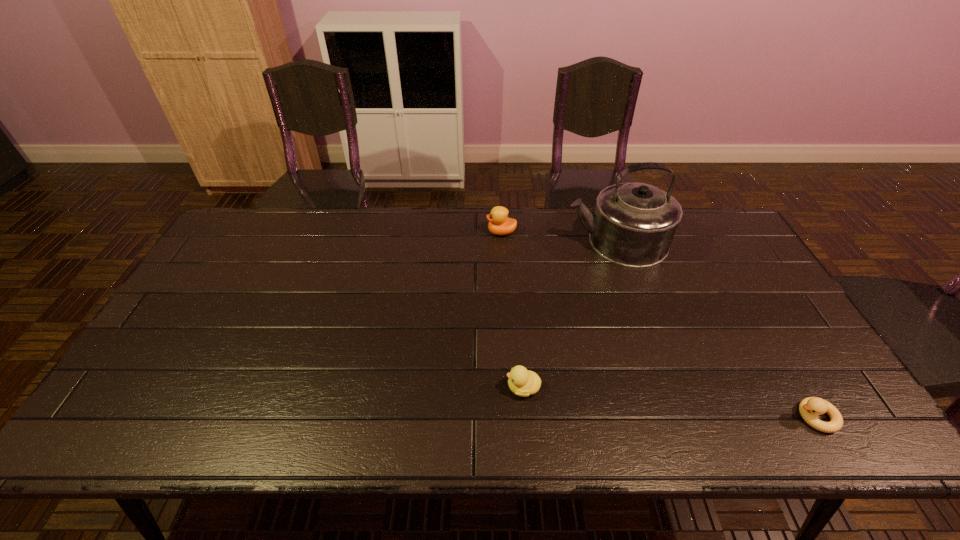
In the image, there is a desktop. At what (x,y) coordinates should I click in order to perform the action: click on vacant space at the near edge. Please return your answer as a coordinate pair (x, y). Looking at the image, I should click on (515, 438).

Find the location of a particular element. vacant area at the left edge of the desktop is located at coordinates (211, 345).

Find the location of `vacant region at the right edge of the desktop`. vacant region at the right edge of the desktop is located at coordinates (783, 376).

Where is `free region at the far left corner of the desktop`? The height and width of the screenshot is (540, 960). free region at the far left corner of the desktop is located at coordinates (252, 244).

What are the coordinates of `free area in between the rightmost object and the farthest duckling` in the screenshot? It's located at (659, 325).

I want to click on empty space between the rightmost duckling and the kettle, so click(716, 329).

This screenshot has height=540, width=960. I want to click on free point between the tallest duckling and the tallest object, so click(559, 237).

Locate an element on the screen. This screenshot has width=960, height=540. vacant area that lies between the rightmost object and the tallest duckling is located at coordinates (659, 325).

Locate an element on the screen. empty space that is in between the kettle and the rightmost duckling is located at coordinates (716, 329).

In order to click on object that can be found as the third closest to the tallest duckling in this screenshot , I will do `click(810, 407)`.